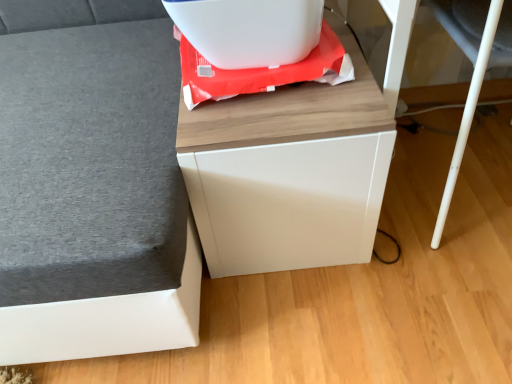
Locate an element on the screen. vacant area situated below white plastic swivel chair at lower right (from a real-world perspective) is located at coordinates (461, 176).